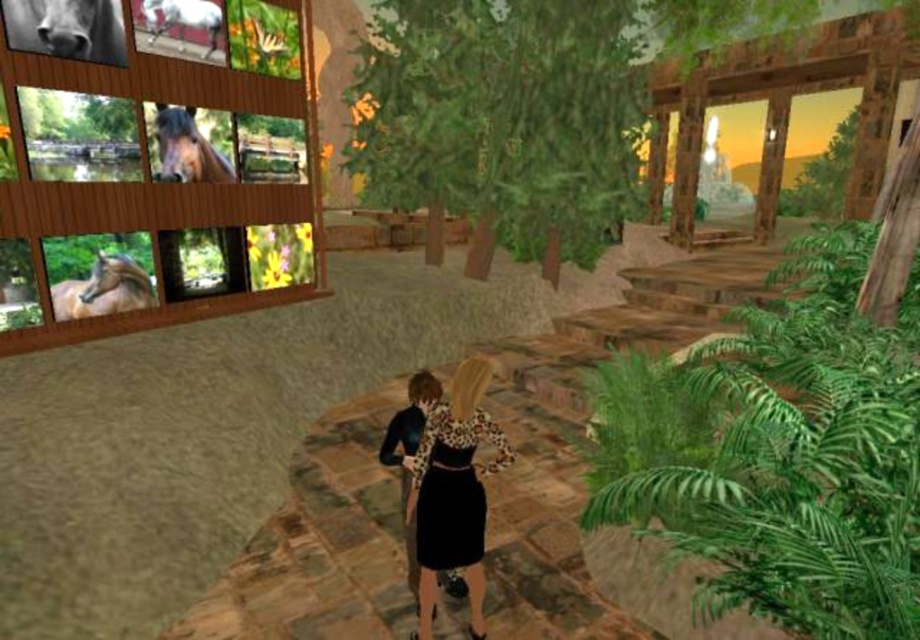
Question: Which is farther from the green leafy trees at center?

Choices:
 (A) black glossy horse at upper left
 (B) brown glossy horse at left

Answer: (B)

Question: Is green leafy trees at center to the right of brown glossy horse at left from the viewer's perspective?

Choices:
 (A) no
 (B) yes

Answer: (B)

Question: Which of the following is the closest to the observer?

Choices:
 (A) brown glossy horse at left
 (B) black leopard print dress at center

Answer: (B)

Question: Does black glossy horse at upper left have a larger size compared to black leopard print dress at center?

Choices:
 (A) yes
 (B) no

Answer: (B)

Question: Observing the image, what is the correct spatial positioning of black leopard print dress at center in reference to brown glossy horse at upper left?

Choices:
 (A) left
 (B) right

Answer: (B)

Question: Based on their relative distances, which object is nearer to the black leopard print dress at center?

Choices:
 (A) green leafy plant at upper right
 (B) brown glossy horse at left
 (C) brown glossy horse at upper left
 (D) white glossy horse at upper left

Answer: (B)